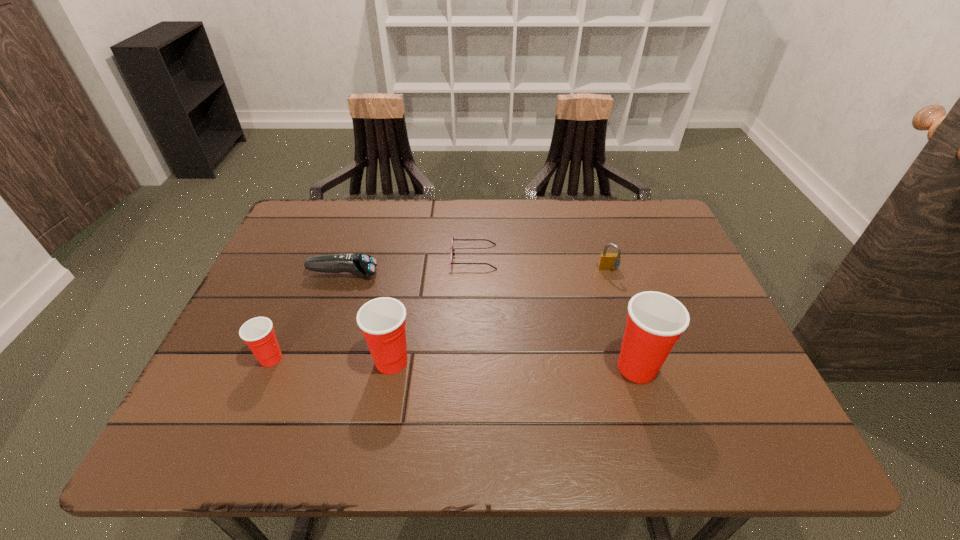
You are a GUI agent. You are given a task and a screenshot of the screen. Output one action in this format:
    pyautogui.click(x=<x>, y=<y>)
    Task: Click on the leftmost Dixie cup
    This screenshot has width=960, height=540.
    Given the screenshot: What is the action you would take?
    pyautogui.click(x=258, y=333)

At what (x,y) coordinates should I click in order to perform the action: click on the third object from left to right. Please return your answer as a coordinate pair (x, y). Image resolution: width=960 pixels, height=540 pixels. Looking at the image, I should click on (382, 321).

Find the location of a particular element. This screenshot has height=540, width=960. the fifth shortest object is located at coordinates (382, 321).

Where is `the rightmost Dixie cup`? the rightmost Dixie cup is located at coordinates (655, 321).

Image resolution: width=960 pixels, height=540 pixels. In order to click on padlock in this screenshot , I will do `click(608, 261)`.

Where is `electric shaver`? This screenshot has width=960, height=540. electric shaver is located at coordinates (362, 265).

Where is `sunglasses`? This screenshot has height=540, width=960. sunglasses is located at coordinates (452, 250).

Locate an element on the screen. The image size is (960, 540). the shortest object is located at coordinates (452, 250).

Identify the location of vacant space located on the back of the leftmost Dixie cup. Image resolution: width=960 pixels, height=540 pixels. (318, 247).

This screenshot has height=540, width=960. In order to click on vacant space located on the right of the fourth object from right to left in this screenshot , I will do `click(585, 361)`.